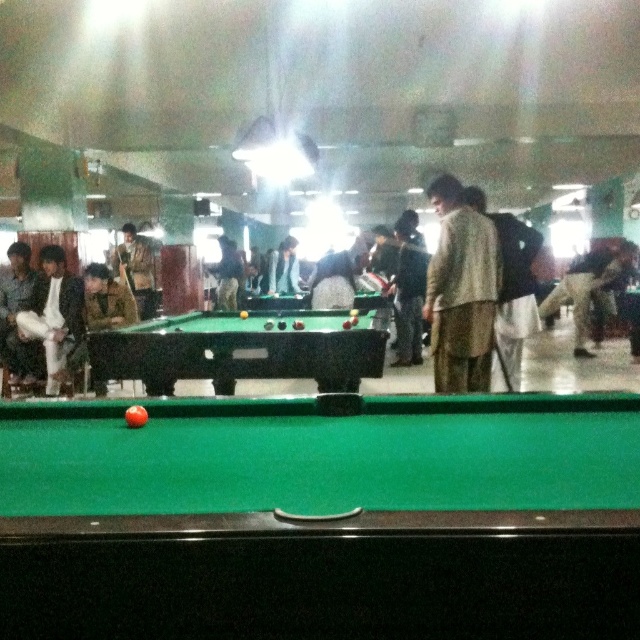
Is green felt billiard table at center below light brown fabric shirt at left?

Indeed, green felt billiard table at center is positioned under light brown fabric shirt at left.

From the picture: Who is more distant from viewer, (387,435) or (26,282)?

The point (26,282) is more distant.

You are a GUI agent. You are given a task and a screenshot of the screen. Output one action in this format:
    pyautogui.click(x=<x>, y=<y>)
    Task: Click on the green felt billiard table at center
    The width and height of the screenshot is (640, 640).
    Given the screenshot: What is the action you would take?
    click(323, 518)

Between green felt billiard table at center and green felt pool table at center, which one is positioned lower?

green felt billiard table at center is below.

Between green felt billiard table at center and green felt pool table at center, which one has more height?

With more height is green felt pool table at center.

Does point (29, 513) lie in front of point (179, 349)?

Yes, it is.

The height and width of the screenshot is (640, 640). Find the location of `green felt billiard table at center`. green felt billiard table at center is located at coordinates (323, 518).

Which is more to the left, white cotton pants at left or light brown fabric shirt at left?

light brown fabric shirt at left is more to the left.

Which is behind, point (45, 330) or point (35, 372)?

Point (45, 330)

Locate an element on the screen. The height and width of the screenshot is (640, 640). white cotton pants at left is located at coordinates (54, 317).